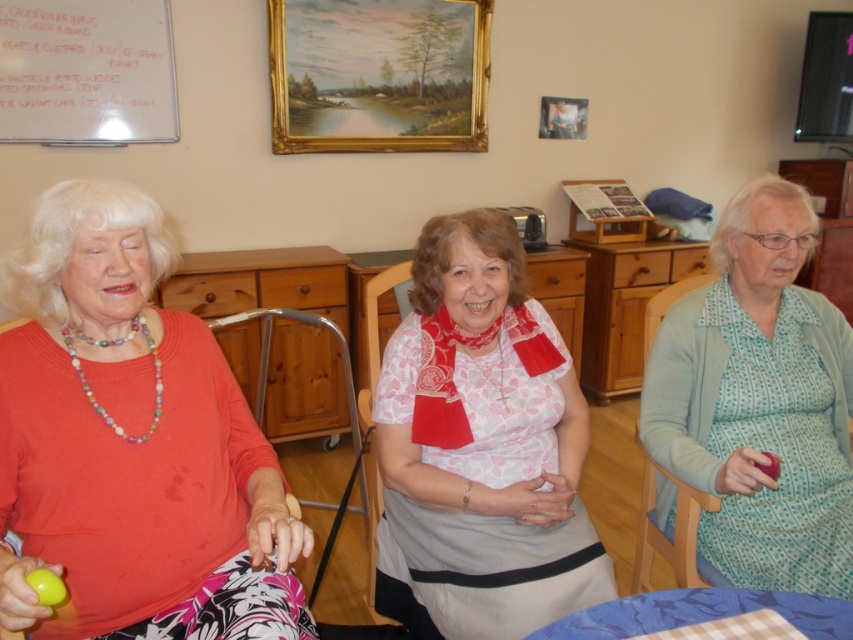
Between point (100, 61) and point (566, 97), which one is positioned behind?

The point (566, 97) is behind.

Is whiteboard at upper left positioned in front of wooden picture frame at upper center?

Yes, it is in front of wooden picture frame at upper center.

Which is in front, point (125, 124) or point (548, 113)?

Point (125, 124) is more forward.

The width and height of the screenshot is (853, 640). In order to click on whiteboard at upper left in this screenshot , I will do `click(86, 72)`.

Is matte orange sweater at left positioned at the back of white cotton blouse at center?

That is False.

Is matte orange sweater at left smaller than white cotton blouse at center?

No, matte orange sweater at left is not smaller than white cotton blouse at center.

Where is `matte orange sweater at left`? This screenshot has height=640, width=853. matte orange sweater at left is located at coordinates (131, 444).

Is light blue dotted cardigan at right above gold/gilded picture frame at upper center?

Incorrect, light blue dotted cardigan at right is not positioned above gold/gilded picture frame at upper center.

You are a GUI agent. You are given a task and a screenshot of the screen. Output one action in this format:
    pyautogui.click(x=<x>, y=<y>)
    Task: Click on the light blue dotted cardigan at right
    
    Given the screenshot: What is the action you would take?
    pyautogui.click(x=759, y=401)